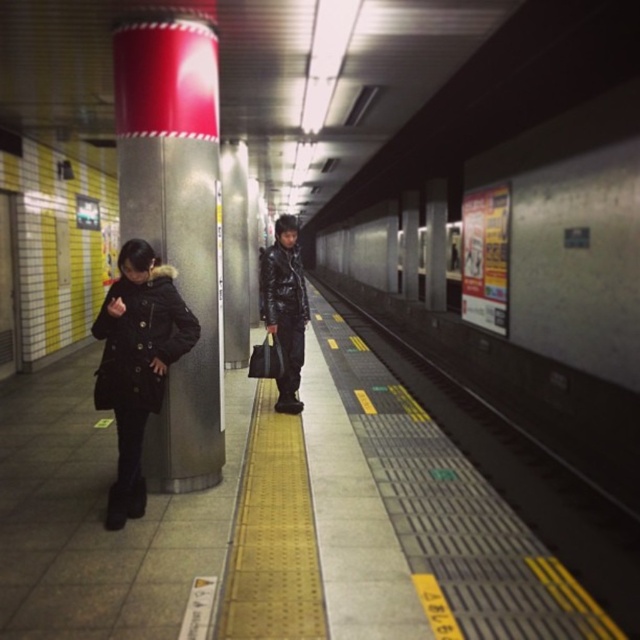
You are standing on the subway platform and want to board the train. The platform has yellow tactile paving along the edge. There is a pillar with a red top and metallic silver lower part on the left. You see a point marked at coordinates (525, 227). Based on the scene, where is this point located?

The point marked at coordinates (525, 227) is located on the metallic silver train at center.

You are a delivery robot with a package that is 1.8 meters wide. You need to navigate between the metallic silver pillar at left and the shiny black jacket at center to deliver the package. Can you fit through the space between them?

The metallic silver pillar at left and shiny black jacket at center are 1.78 meters apart. Since the package is 1.8 meters wide, it is slightly wider than the available space. Therefore, the delivery robot cannot fit through the space between them.

You are a visually impaired person navigating the subway platform. You feel the yellow tactile paving at your feet and want to locate the nearest pillar for support. Given that the yellow tactile paving is along the platform edge, can you determine the direction to walk from your current position to reach the pillar represented by point (177,227)?

The pillar represented by point (177,227) is located at the left side of the platform. Since the yellow tactile paving is along the platform edge, you should walk towards the left to reach the pillar.